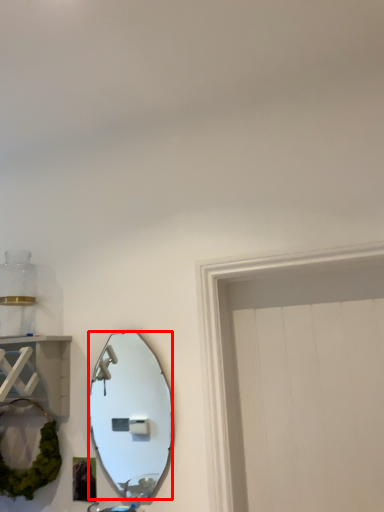
Question: From the image's perspective, where is mirror (annotated by the red box) located in relation to cabinet in the image?

Choices:
 (A) below
 (B) above

Answer: (A)